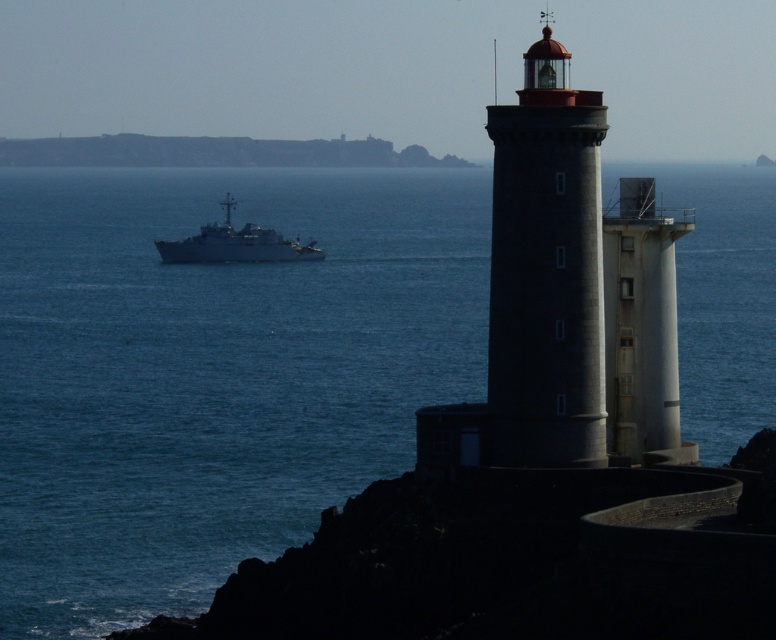
Question: Does blue water at center lie in front of smooth gray lighthouse at center?

Choices:
 (A) yes
 (B) no

Answer: (B)

Question: Which of these objects is positioned farthest from the blue water at center?

Choices:
 (A) smooth gray lighthouse at center
 (B) white matte ship at center

Answer: (A)

Question: Is blue water at center above white matte ship at center?

Choices:
 (A) yes
 (B) no

Answer: (B)

Question: Does smooth gray lighthouse at center appear on the left side of white matte ship at center?

Choices:
 (A) yes
 (B) no

Answer: (B)

Question: Based on their relative distances, which object is nearer to the blue water at center?

Choices:
 (A) smooth gray lighthouse at center
 (B) white matte ship at center

Answer: (B)

Question: Which point appears farthest from the camera in this image?

Choices:
 (A) (553, 129)
 (B) (171, 253)
 (C) (286, 518)

Answer: (B)